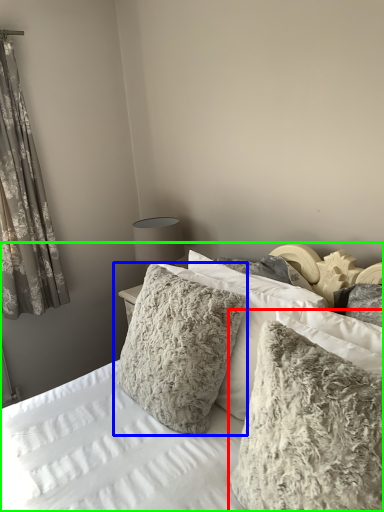
Question: Estimate the real-world distances between objects in this image. Which object is closer to pillow (highlighted by a red box), pillow (highlighted by a blue box) or bed (highlighted by a green box)?

Choices:
 (A) pillow
 (B) bed

Answer: (B)